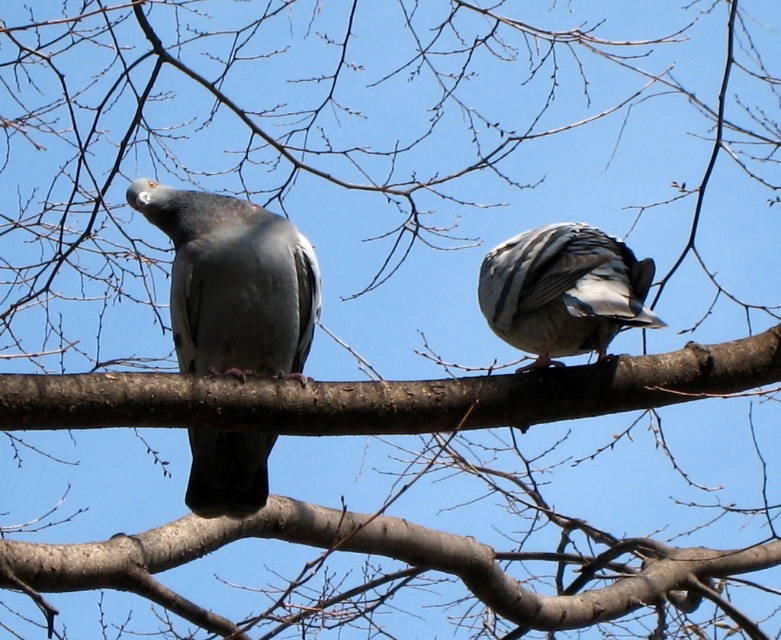
You are a birdwatcher observing the scene. You notice the brown rough branch at center and the gray matte pigeon at left. Which object is located below the other?

The brown rough branch at center is positioned under the gray matte pigeon at left, meaning the pigeon is above the branch.

You are a birdwatcher trying to capture both pigeons in a photo. The camera you have can only focus on objects within a 12 inch range. Given the distance between the gray matte pigeon at left and the speckled gray pigeon at center, will your camera be able to capture both pigeons in focus in a single shot?

The distance between the gray matte pigeon at left and the speckled gray pigeon at center is 14.04 inches, which exceeds the camera focus range of 12 inches. Therefore, the camera cannot capture both pigeons in focus simultaneously in a single shot.